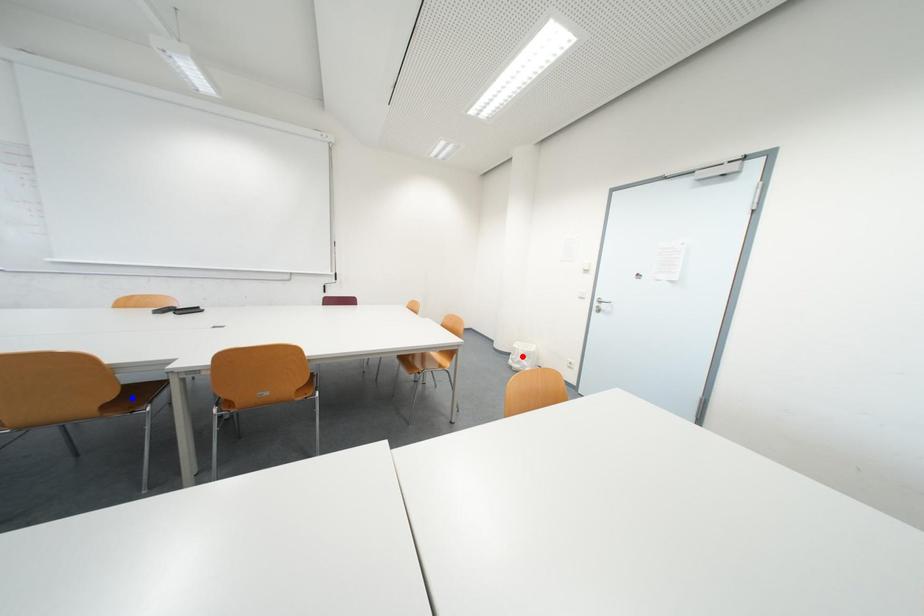
Question: Two points are marked on the image. Which point is closer to the camera?

Choices:
 (A) Blue point is closer.
 (B) Red point is closer.

Answer: (A)